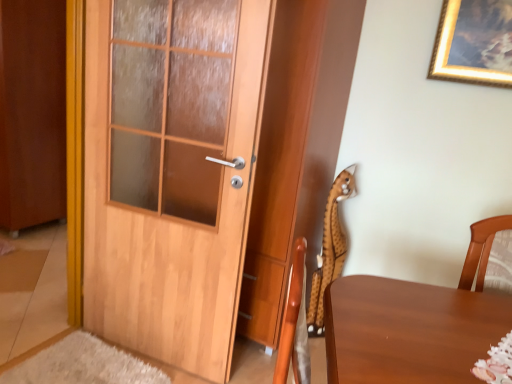
Question: Is brown wooden door at left to the left of spotted plush toy at right from the viewer's perspective?

Choices:
 (A) no
 (B) yes

Answer: (B)

Question: Does brown wooden door at left lie in front of spotted plush toy at right?

Choices:
 (A) no
 (B) yes

Answer: (A)

Question: Is brown wooden door at left smaller than spotted plush toy at right?

Choices:
 (A) no
 (B) yes

Answer: (A)

Question: Does brown wooden door at left come behind spotted plush toy at right?

Choices:
 (A) no
 (B) yes

Answer: (B)

Question: From a real-world perspective, is brown wooden door at left over spotted plush toy at right?

Choices:
 (A) yes
 (B) no

Answer: (A)

Question: Considering their positions, is wooden door at left located in front of or behind spotted plush toy at right?

Choices:
 (A) front
 (B) behind

Answer: (A)

Question: Is point (178, 59) positioned closer to the camera than point (326, 231)?

Choices:
 (A) closer
 (B) farther

Answer: (A)

Question: Is wooden door at left wider or thinner than spotted plush toy at right?

Choices:
 (A) thin
 (B) wide

Answer: (B)

Question: From a real-world perspective, is wooden door at left physically located above or below spotted plush toy at right?

Choices:
 (A) below
 (B) above

Answer: (B)

Question: From the image's perspective, is wooden door at left located above or below brown wooden door at left?

Choices:
 (A) above
 (B) below

Answer: (B)

Question: Considering the positions of wooden door at left and brown wooden door at left in the image, is wooden door at left bigger or smaller than brown wooden door at left?

Choices:
 (A) small
 (B) big

Answer: (A)

Question: Considering the positions of point (128, 117) and point (4, 139), is point (128, 117) closer or farther from the camera than point (4, 139)?

Choices:
 (A) farther
 (B) closer

Answer: (B)

Question: In terms of height, does wooden door at left look taller or shorter compared to brown wooden door at left?

Choices:
 (A) tall
 (B) short

Answer: (B)

Question: Would you say spotted plush toy at right is to the left or to the right of wooden door at left in the picture?

Choices:
 (A) right
 (B) left

Answer: (A)

Question: Is spotted plush toy at right taller or shorter than wooden door at left?

Choices:
 (A) tall
 (B) short

Answer: (B)